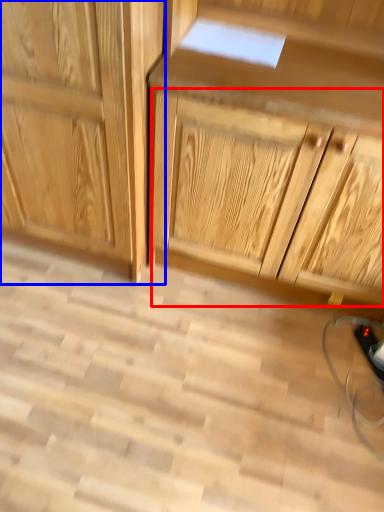
Question: Which object is closer to the camera taking this photo, drawer (highlighted by a red box) or cabinetry (highlighted by a blue box)?

Choices:
 (A) drawer
 (B) cabinetry

Answer: (A)